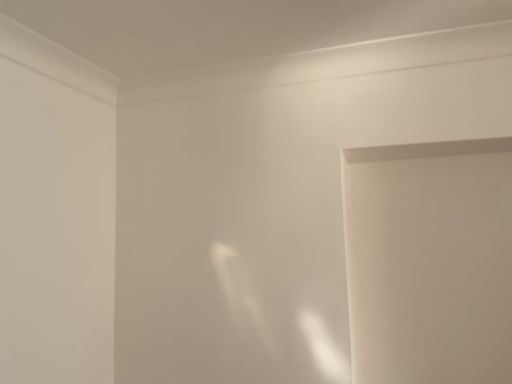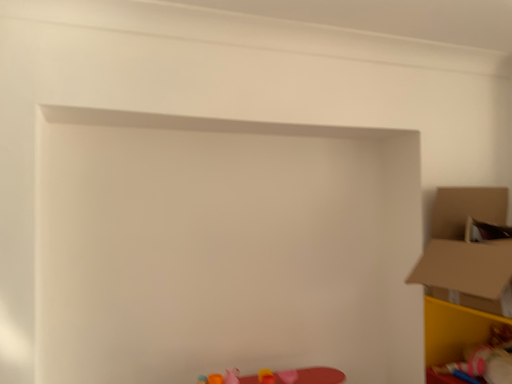
Question: Which way did the camera rotate in the video?

Choices:
 (A) rotated right
 (B) rotated left

Answer: (A)